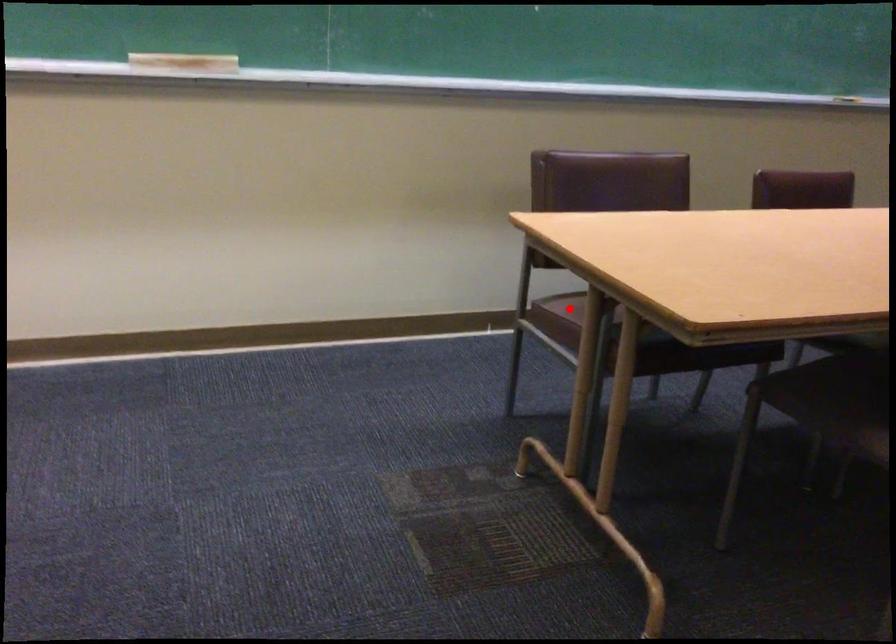
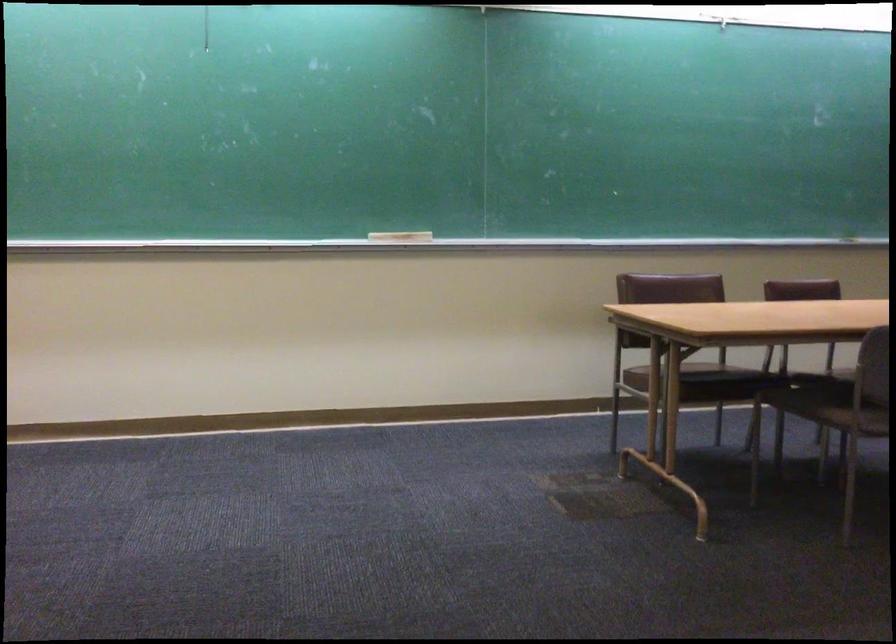
Question: I am providing you with two images of the same scene from different viewpoints. Image1 has a red point marked. In image2, the corresponding 3D location appears at what relative position? Reply with the corresponding letter.

Choices:
 (A) Closer
 (B) Farther

Answer: (B)